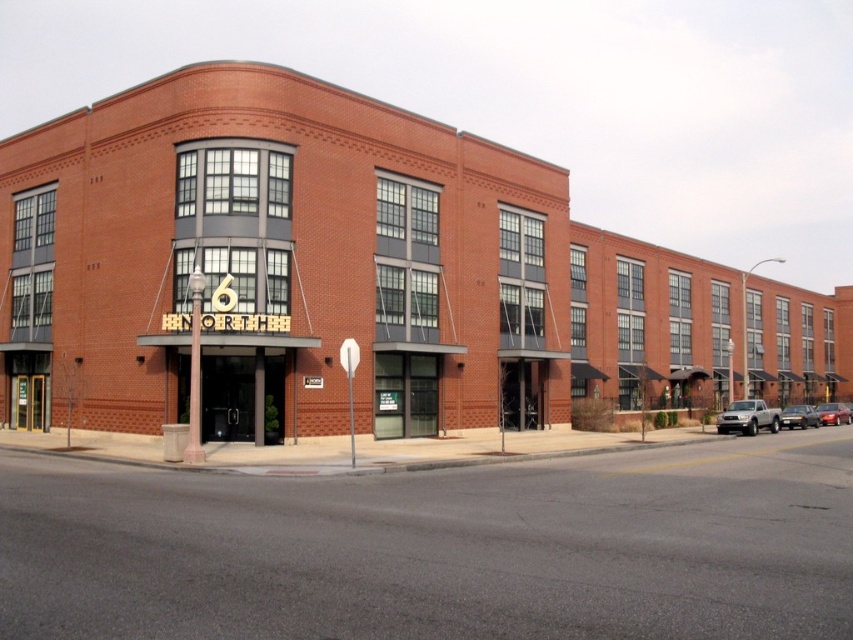
You are a delivery driver who needs to park your vehicle in the parking lot near the building. You have a satin silver truck at lower right and a metallic silver sedan at center. Which vehicle will require more space to park?

The metallic silver sedan at center requires more space to park because the satin silver truck at lower right has a lesser width compared to metallic silver sedan at center.

You are standing at the entrance of Hanover Hall, looking at the building. There is a point marked at coordinates [747,417]. What object is located at that point?

The satin silver truck at lower right is located at point [747,417].